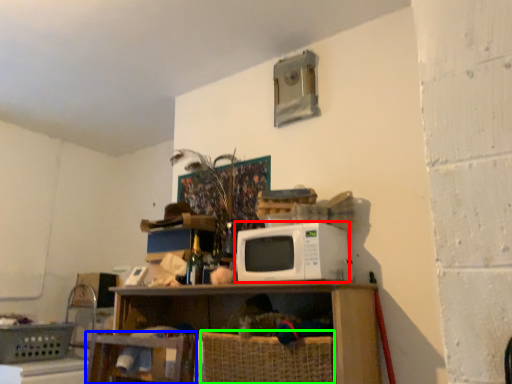
Question: Which object is positioned farthest from microwave oven (highlighted by a red box)? Select from swivel chair (highlighted by a blue box) and basket (highlighted by a green box).

Choices:
 (A) swivel chair
 (B) basket

Answer: (A)